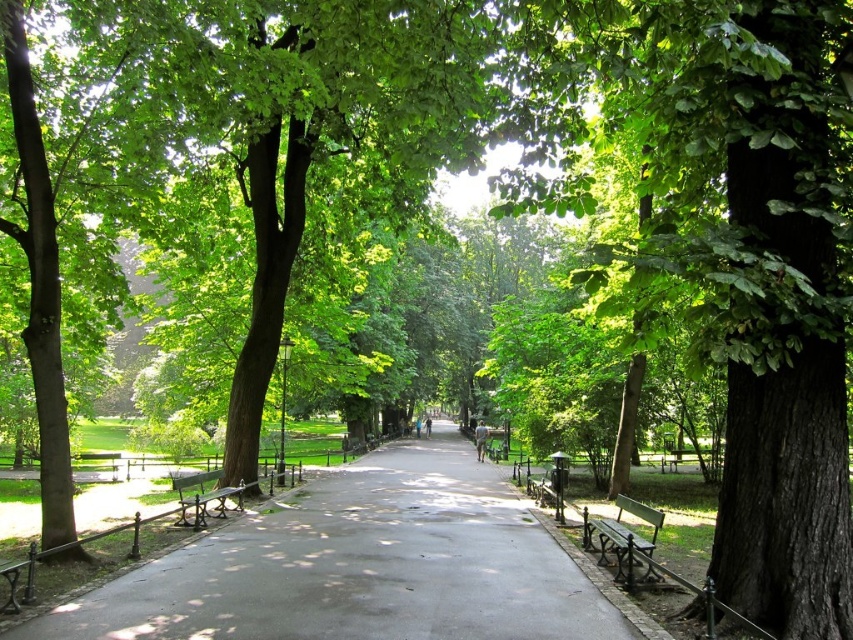
Is smooth asphalt path at center to the left of wooden park bench at center from the viewer's perspective?

Incorrect, smooth asphalt path at center is not on the left side of wooden park bench at center.

Is smooth asphalt path at center closer to the viewer compared to wooden park bench at center?

Yes, it is in front of wooden park bench at center.

Which is behind, point (485, 614) or point (276, 472)?

The point (276, 472) is behind.

Find the location of a particular element. smooth asphalt path at center is located at coordinates point(360,564).

Describe the element at coordinates (360, 564) in the screenshot. I see `smooth asphalt path at center` at that location.

Can you confirm if smooth asphalt path at center is shorter than wooden bench at center?

In fact, smooth asphalt path at center may be taller than wooden bench at center.

Who is more distant from viewer, (579, 573) or (239, 492)?

Positioned behind is point (239, 492).

Find the location of `smooth asphalt path at center`. smooth asphalt path at center is located at coordinates (360, 564).

Which is behind, point (538, 586) or point (640, 550)?

The point (640, 550) is behind.

In the scene shown: Is smooth asphalt path at center wider than green wooden bench at right?

Correct, the width of smooth asphalt path at center exceeds that of green wooden bench at right.

Between point (506, 584) and point (585, 522), which one is positioned behind?

The point (585, 522) is behind.

Find the location of a particular element. smooth asphalt path at center is located at coordinates (360, 564).